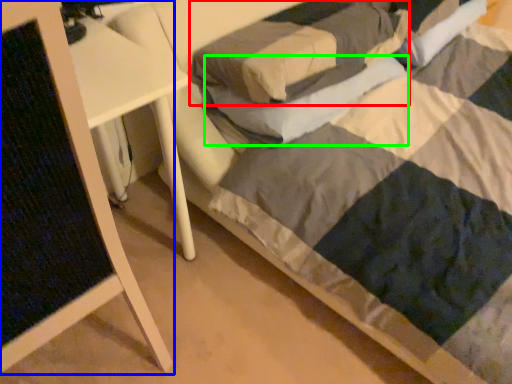
Question: Which object is positioned farthest from pillow (highlighted by a red box)? Select from furniture (highlighted by a blue box) and pillow (highlighted by a green box).

Choices:
 (A) furniture
 (B) pillow

Answer: (A)